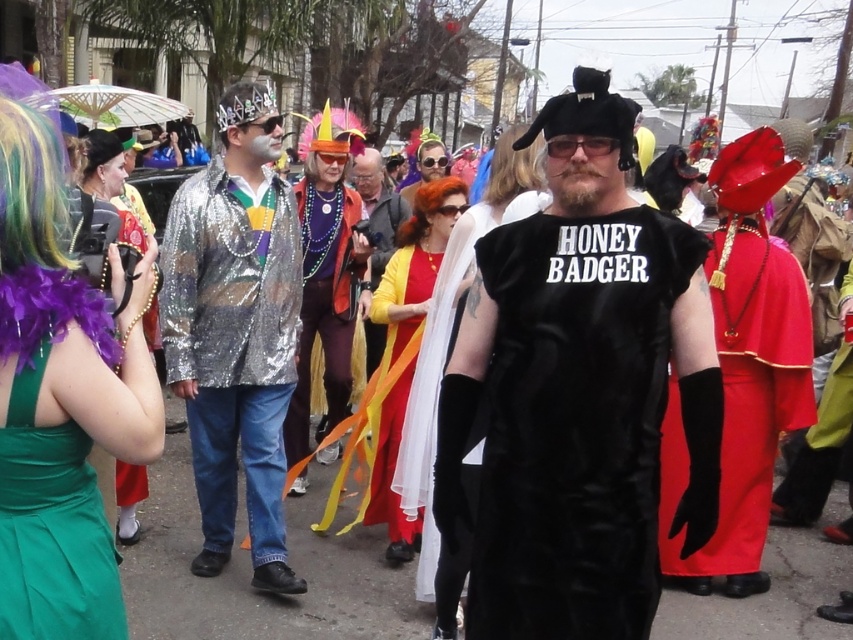
Question: Estimate the real-world distances between objects in this image. Which object is closer to the velvet red cape at right?

Choices:
 (A) shiny silver wig at upper center
 (B) green satin dress at lower left
 (C) dark brown curly wig at upper left
 (D) shiny metallic jacket at center

Answer: (D)

Question: Is velvet red cape at right to the right of green satin dress at lower left from the viewer's perspective?

Choices:
 (A) yes
 (B) no

Answer: (A)

Question: Is velvet black vest at center to the right of yellow satin dress at center from the viewer's perspective?

Choices:
 (A) no
 (B) yes

Answer: (B)

Question: In this image, where is velvet red cape at right located relative to multicolored feathered wig at upper left?

Choices:
 (A) below
 (B) above

Answer: (A)

Question: Which object appears closest to the camera in this image?

Choices:
 (A) multicolored feathered wig at upper left
 (B) green satin dress at lower left
 (C) shiny silver wig at upper center

Answer: (A)

Question: Among these points, which one is nearest to the camera?

Choices:
 (A) (422, 182)
 (B) (656, 228)
 (C) (231, 122)
 (D) (737, 502)

Answer: (B)